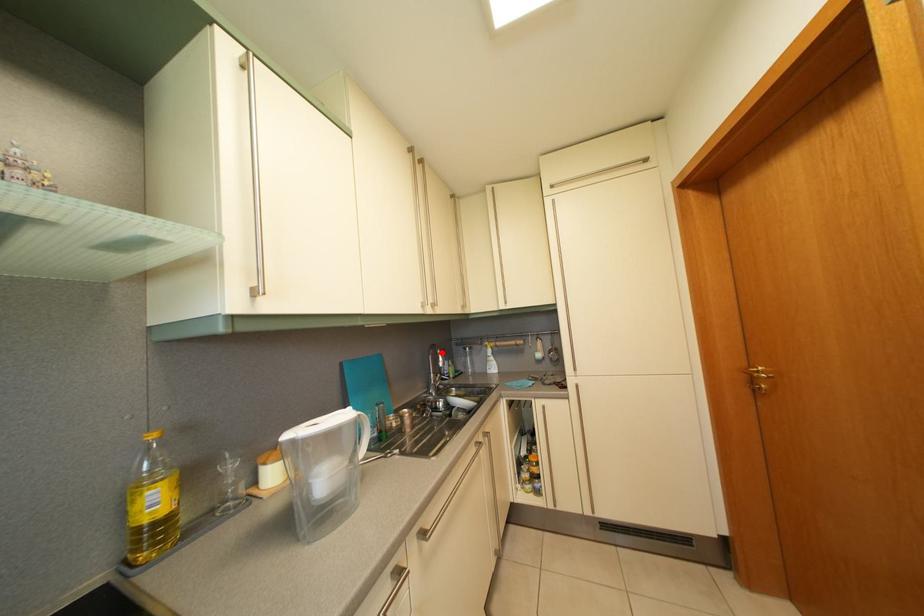
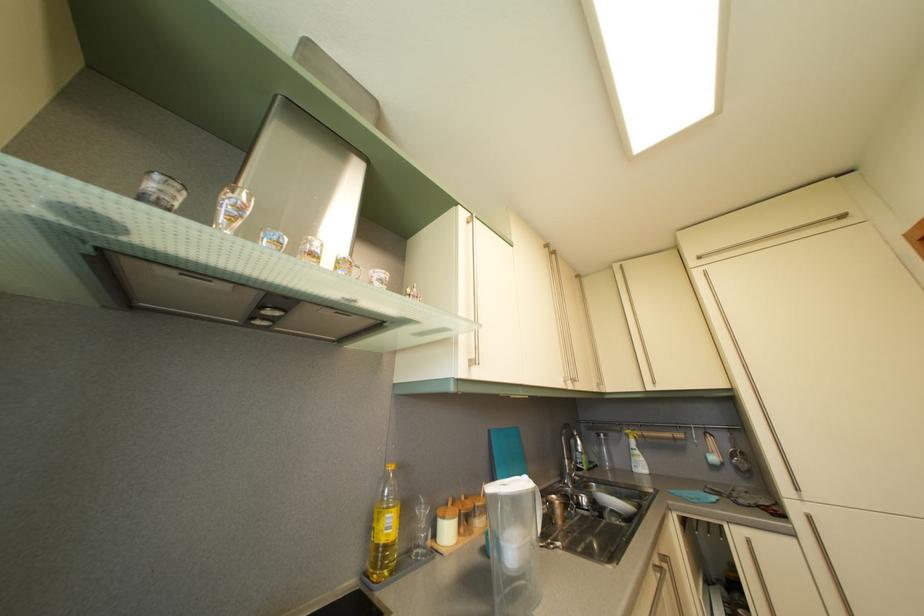
Find the pixel in the second image that matches the highlighted location in the first image.

(575, 432)